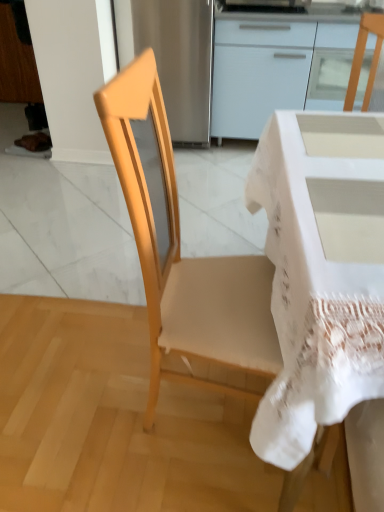
Locate an element on the screen. This screenshot has width=384, height=512. vacant space to the left of light wood chair at center is located at coordinates (92, 395).